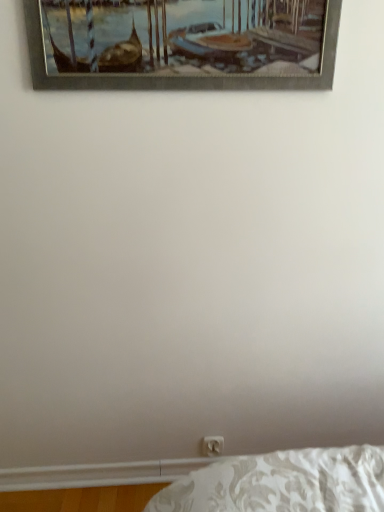
Question: Is white plastic electric outlet at lower center not within metallic silver picture frame at upper center?

Choices:
 (A) no
 (B) yes

Answer: (B)

Question: Considering the relative sizes of white plastic electric outlet at lower center and metallic silver picture frame at upper center in the image provided, is white plastic electric outlet at lower center smaller than metallic silver picture frame at upper center?

Choices:
 (A) no
 (B) yes

Answer: (B)

Question: From a real-world perspective, is white plastic electric outlet at lower center beneath metallic silver picture frame at upper center?

Choices:
 (A) yes
 (B) no

Answer: (A)

Question: Does white plastic electric outlet at lower center have a greater height compared to metallic silver picture frame at upper center?

Choices:
 (A) yes
 (B) no

Answer: (B)

Question: Does white plastic electric outlet at lower center have a larger size compared to metallic silver picture frame at upper center?

Choices:
 (A) no
 (B) yes

Answer: (A)

Question: Can you confirm if white plastic electric outlet at lower center is wider than metallic silver picture frame at upper center?

Choices:
 (A) yes
 (B) no

Answer: (B)

Question: Considering the relative sizes of metallic silver picture frame at upper center and white plastic electric outlet at lower center in the image provided, is metallic silver picture frame at upper center bigger than white plastic electric outlet at lower center?

Choices:
 (A) yes
 (B) no

Answer: (A)

Question: From a real-world perspective, is metallic silver picture frame at upper center located higher than white plastic electric outlet at lower center?

Choices:
 (A) yes
 (B) no

Answer: (A)

Question: From the image's perspective, does metallic silver picture frame at upper center appear lower than white plastic electric outlet at lower center?

Choices:
 (A) no
 (B) yes

Answer: (A)

Question: Considering the relative sizes of metallic silver picture frame at upper center and white plastic electric outlet at lower center in the image provided, is metallic silver picture frame at upper center taller than white plastic electric outlet at lower center?

Choices:
 (A) no
 (B) yes

Answer: (B)

Question: Can you confirm if metallic silver picture frame at upper center is shorter than white plastic electric outlet at lower center?

Choices:
 (A) no
 (B) yes

Answer: (A)

Question: Is metallic silver picture frame at upper center directly adjacent to white plastic electric outlet at lower center?

Choices:
 (A) no
 (B) yes

Answer: (A)

Question: Looking at their shapes, would you say white plastic electric outlet at lower center is wider or thinner than metallic silver picture frame at upper center?

Choices:
 (A) thin
 (B) wide

Answer: (A)